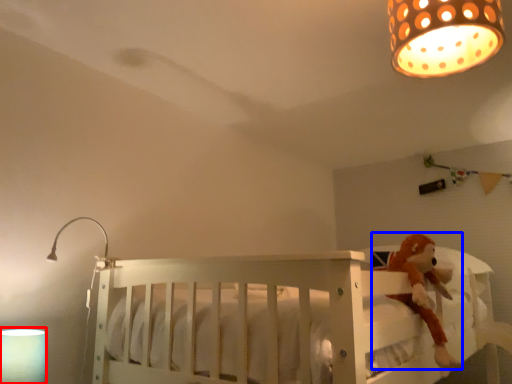
Question: Which point is closer to the camera, lamp (highlighted by a red box) or toy (highlighted by a blue box)?

Choices:
 (A) lamp
 (B) toy

Answer: (A)